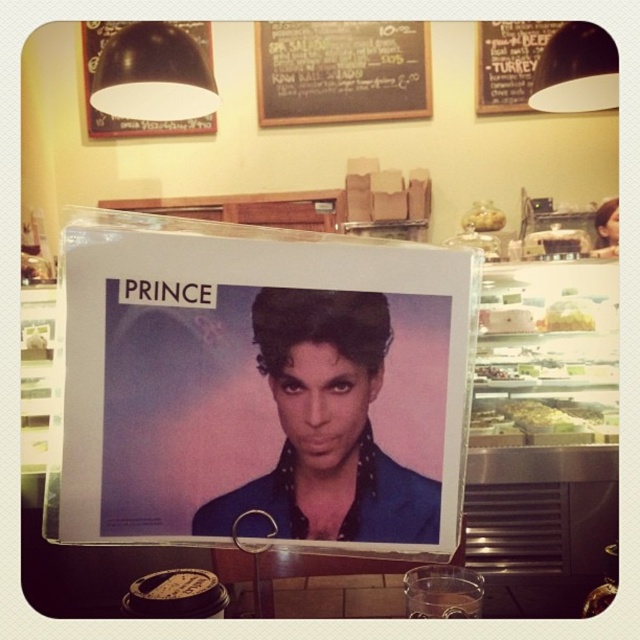
Which is below, black chalkboard at upper center or translucent plastic food at center?

translucent plastic food at center is below.

Who is higher up, black chalkboard at upper center or translucent plastic food at center?

Positioned higher is black chalkboard at upper center.

Who is more distant from viewer, (512, 80) or (573, 308)?

Point (512, 80)

You are a GUI agent. You are given a task and a screenshot of the screen. Output one action in this format:
    pyautogui.click(x=<x>, y=<y>)
    Task: Click on the black chalkboard at upper center
    This screenshot has height=640, width=640.
    Given the screenshot: What is the action you would take?
    pyautogui.click(x=508, y=64)

Is black matte bulletin board at upper left bigger than green leafy salad at center?

Indeed, black matte bulletin board at upper left has a larger size compared to green leafy salad at center.

Consider the image. Between black matte bulletin board at upper left and green leafy salad at center, which one is positioned lower?

Positioned lower is green leafy salad at center.

Which is in front, point (90, 61) or point (522, 400)?

Point (522, 400)

You are a GUI agent. You are given a task and a screenshot of the screen. Output one action in this format:
    pyautogui.click(x=<x>, y=<y>)
    Task: Click on the black matte bulletin board at upper left
    
    Given the screenshot: What is the action you would take?
    pyautogui.click(x=145, y=81)

Is black chalkboard at upper center closer to camera compared to green leafy salad at center?

No, it is not.

Who is more forward, (x=492, y=26) or (x=554, y=428)?

Positioned in front is point (x=554, y=428).

Is point (518, 58) positioned after point (532, 403)?

Yes, it is.

You are a GUI agent. You are given a task and a screenshot of the screen. Output one action in this format:
    pyautogui.click(x=<x>, y=<y>)
    Task: Click on the black chalkboard at upper center
    The width and height of the screenshot is (640, 640).
    Given the screenshot: What is the action you would take?
    pyautogui.click(x=508, y=64)